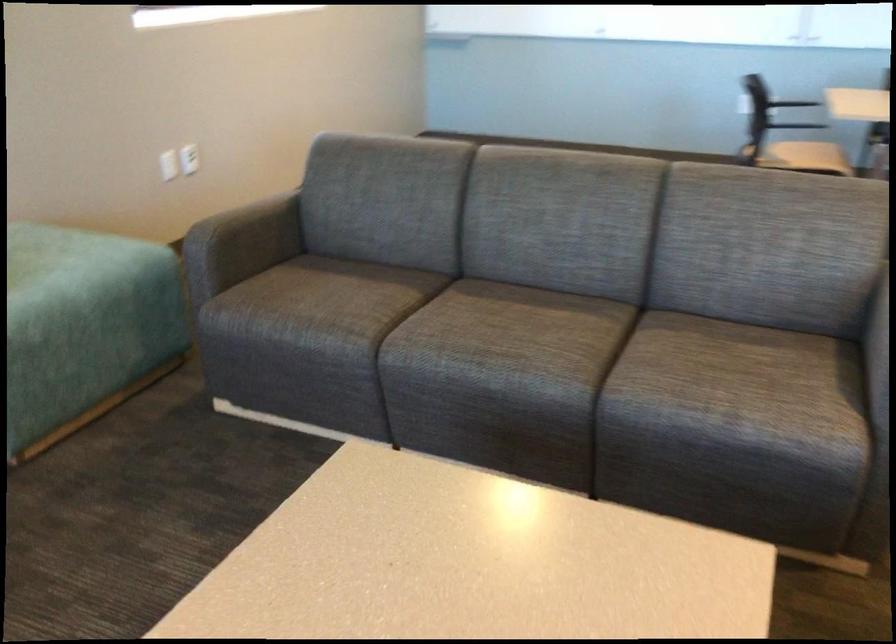
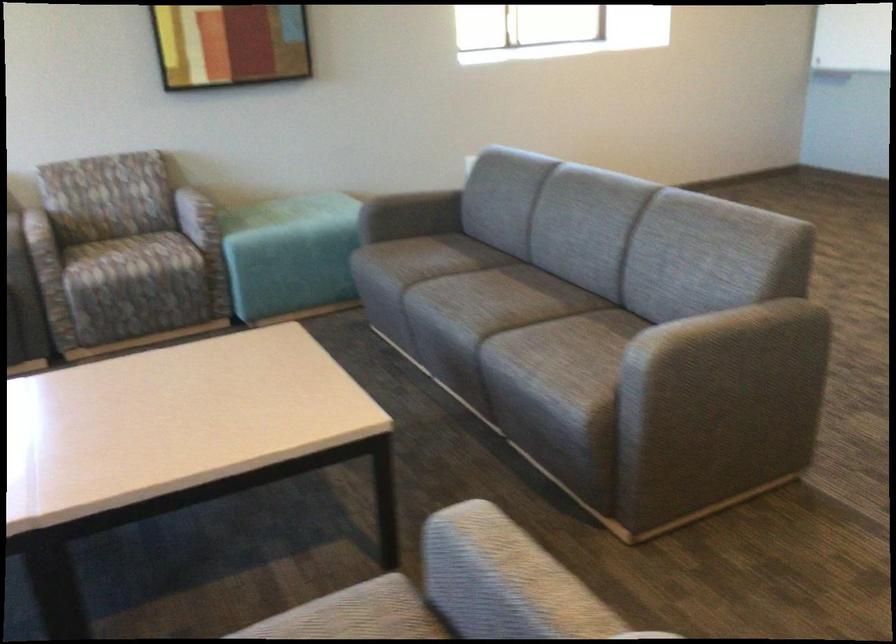
In the second image, find the point that corresponds to point (250, 241) in the first image.

(411, 213)